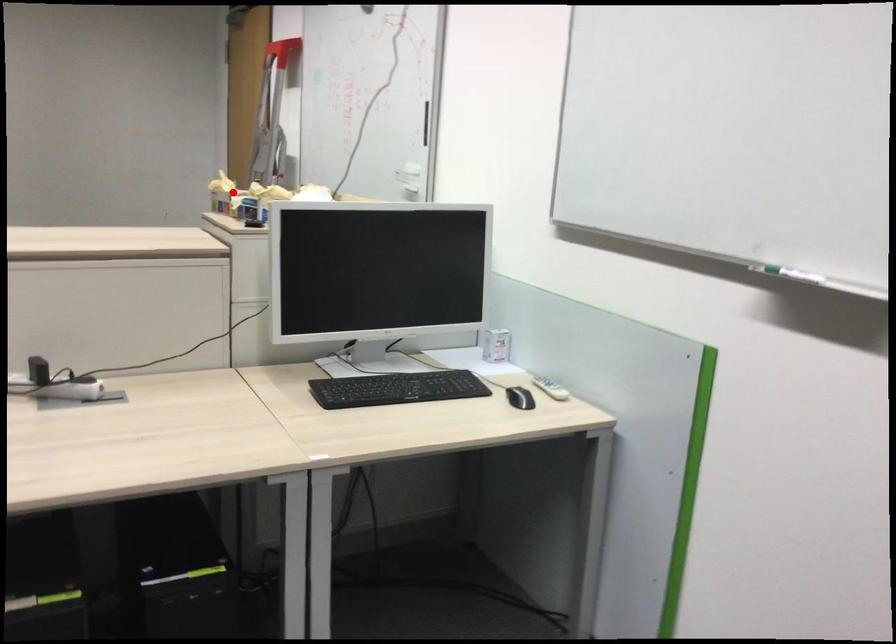
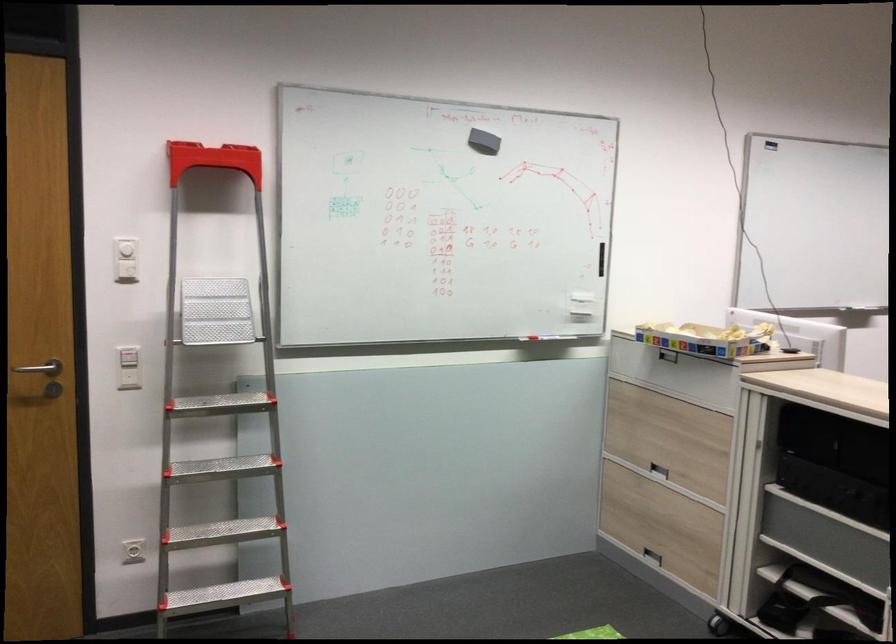
Question: I am providing you with two images of the same scene from different viewpoints. In image1, a red point is highlighted. Considering the same 3D point in image2, which of the following is correct?

Choices:
 (A) It is closer
 (B) It is farther

Answer: (B)